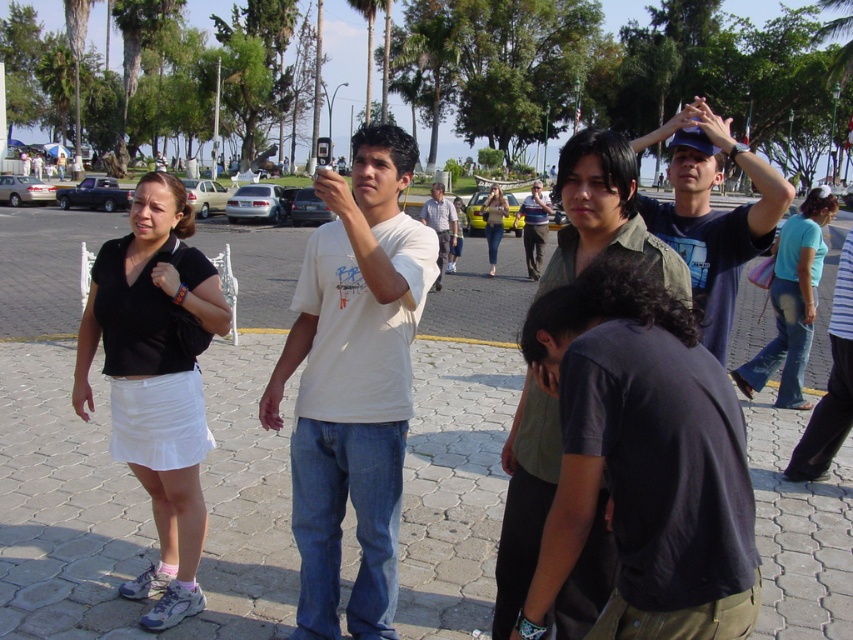
Question: Which of the following is the farthest from the observer?

Choices:
 (A) (480, 211)
 (B) (525, 237)
 (C) (550, 404)

Answer: (A)

Question: Does white cotton t-shirt at center have a larger size compared to black matte skirt at left?

Choices:
 (A) yes
 (B) no

Answer: (B)

Question: Which point is closer to the camera?

Choices:
 (A) (544, 209)
 (B) (592, 228)
 (C) (833, 401)

Answer: (B)

Question: Can you confirm if dark green shirt at center is positioned above white cotton shirt at center?

Choices:
 (A) yes
 (B) no

Answer: (B)

Question: Which object is farther from the camera taking this photo?

Choices:
 (A) black matte skirt at left
 (B) blue jeans at lower right
 (C) white cotton t-shirt at center
 (D) white cotton shirt at center

Answer: (B)

Question: Does white cotton t-shirt at center appear on the left side of white cotton shirt at center?

Choices:
 (A) no
 (B) yes

Answer: (B)